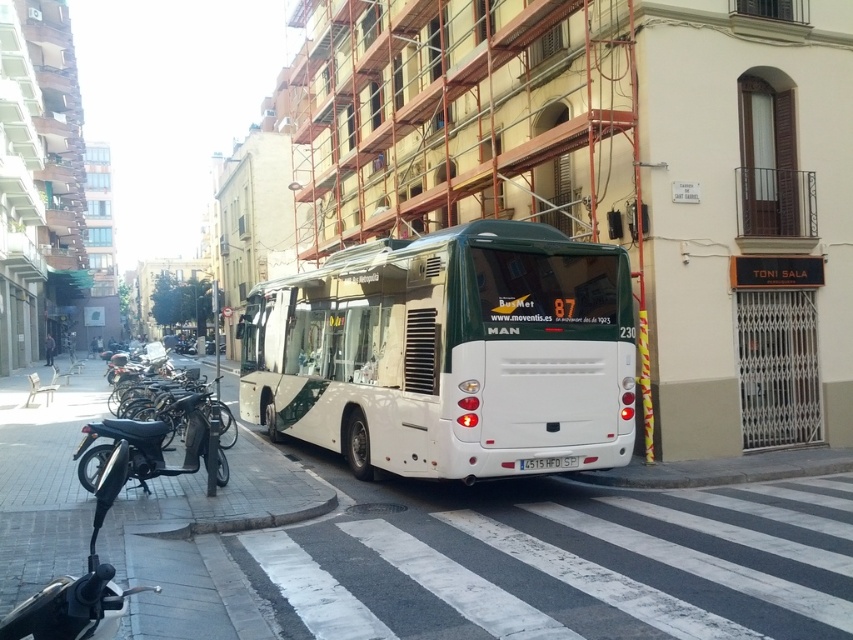
Question: Is white matte bus at center thinner than shiny black motorcycle at lower left?

Choices:
 (A) yes
 (B) no

Answer: (B)

Question: Is white matte bus at center to the right of shiny black motorcycle at lower left from the viewer's perspective?

Choices:
 (A) yes
 (B) no

Answer: (A)

Question: Estimate the real-world distances between objects in this image. Which object is closer to the shiny black motorcycle at lower left?

Choices:
 (A) white plastic license plate at center
 (B) white matte bus at center

Answer: (B)

Question: Which object is the farthest from the white plastic license plate at center?

Choices:
 (A) white matte bus at center
 (B) shiny black motorcycle at lower left

Answer: (B)

Question: Which object is positioned closest to the white plastic license plate at center?

Choices:
 (A) shiny black motorcycle at lower left
 (B) white matte bus at center

Answer: (B)

Question: Considering the relative positions of white matte bus at center and shiny black motorcycle at lower left in the image provided, where is white matte bus at center located with respect to shiny black motorcycle at lower left?

Choices:
 (A) below
 (B) above

Answer: (B)